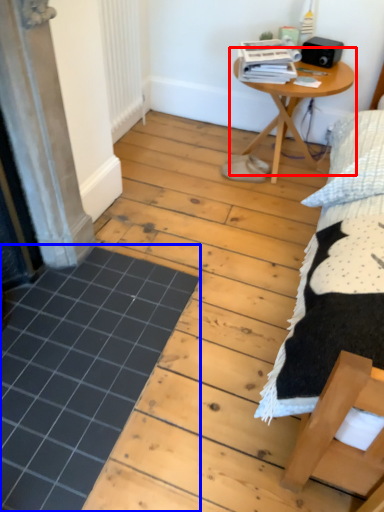
Question: Which object is closer to the camera taking this photo, table (highlighted by a red box) or plank (highlighted by a blue box)?

Choices:
 (A) table
 (B) plank

Answer: (B)